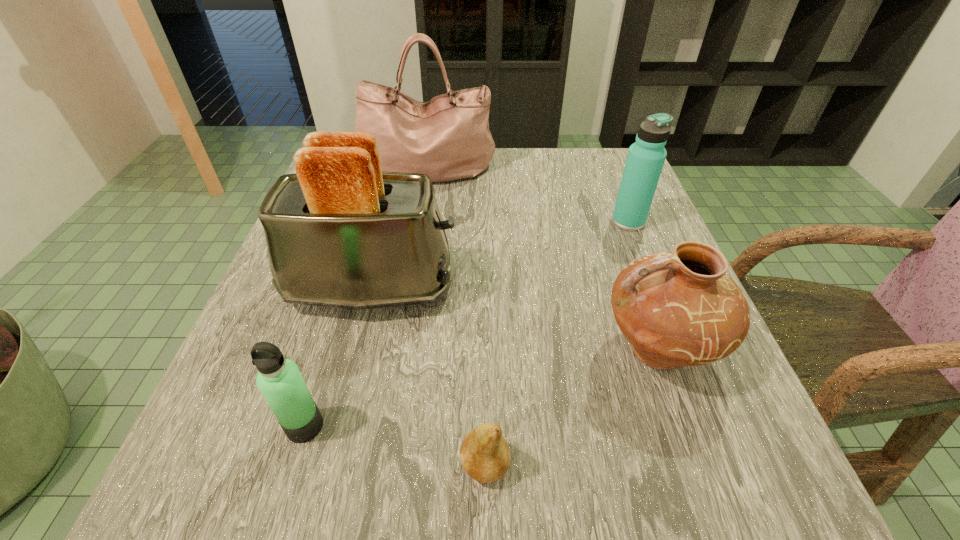
Find the location of a particular element. handbag is located at coordinates (447, 138).

Where is `toaster`? toaster is located at coordinates (341, 233).

What are the coordinates of `the taller thermos bottle` in the screenshot? It's located at (646, 157).

You are a GUI agent. You are given a task and a screenshot of the screen. Output one action in this format:
    pyautogui.click(x=<x>, y=<y>)
    Task: Click on the right thermos bottle
    
    Given the screenshot: What is the action you would take?
    pyautogui.click(x=646, y=157)

The width and height of the screenshot is (960, 540). Identify the location of pottery. (681, 308).

Identify the location of the shorter thermos bottle. coord(279,380).

Image resolution: width=960 pixels, height=540 pixels. I want to click on the left thermos bottle, so click(279, 380).

The height and width of the screenshot is (540, 960). I want to click on pear, so click(x=484, y=454).

Image resolution: width=960 pixels, height=540 pixels. What are the coordinates of `free spot located 0.120m at the front of the handbag with handles` in the screenshot? It's located at 419,221.

The image size is (960, 540). In order to click on vacant point located 0.190m on the side of the toaster with the control lever in this screenshot , I will do `click(563, 288)`.